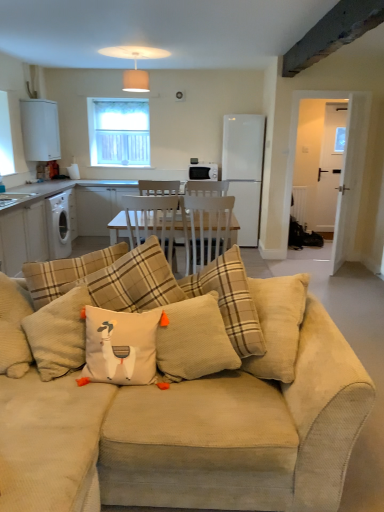
Looking at this image, what is the approximate height of white textured cushion at center, arranged as the second pillow when viewed from the left?

19.72 inches.

What do you see at coordinates (193, 435) in the screenshot?
I see `beige corduroy couch at center` at bounding box center [193, 435].

How much space does black matte toaster at center, which is the second appliance in right-to-left order, occupy vertically?

The height of black matte toaster at center, which is the second appliance in right-to-left order, is 26.77 centimeters.

You are a GUI agent. You are given a task and a screenshot of the screen. Output one action in this format:
    pyautogui.click(x=<x>, y=<y>)
    Task: Click on the black matte toaster at center, arranged as the 1th appliance when viewed from the left
    The height and width of the screenshot is (512, 384).
    Given the screenshot: What is the action you would take?
    pyautogui.click(x=203, y=170)

How much space does white matte refrigerator at center, acting as the first appliance starting from the right, occupy horizontally?

white matte refrigerator at center, acting as the first appliance starting from the right, is 25.98 inches in width.

This screenshot has width=384, height=512. Describe the element at coordinates (333, 33) in the screenshot. I see `dark gray concrete beam at upper right` at that location.

This screenshot has width=384, height=512. Find the location of `dark gray concrete beam at upper right`. dark gray concrete beam at upper right is located at coordinates (333, 33).

What do you see at coordinates (15, 199) in the screenshot? I see `white glossy sink at left` at bounding box center [15, 199].

Measure the distance between white glossy sink at left and camera.

white glossy sink at left and camera are 3.89 meters apart from each other.

Locate an element on the screen. The image size is (384, 512). beige corduroy pillow at center, which appears as the 2th pillow when viewed from the right is located at coordinates (134, 281).

Based on the photo, which of these two, beige corduroy pillow at center, which appears as the 2th pillow when viewed from the right, or beige corduroy couch at center, stands shorter?

beige corduroy pillow at center, which appears as the 2th pillow when viewed from the right.

Is beige corduroy pillow at center, which appears as the 2th pillow when viewed from the right, outside of beige corduroy couch at center?

No, most part of beige corduroy pillow at center, which appears as the 2th pillow when viewed from the right, lies within beige corduroy couch at center.

Is beige corduroy pillow at center, which appears as the 2th pillow when viewed from the right, next to beige corduroy couch at center?

There is a gap between beige corduroy pillow at center, which appears as the 2th pillow when viewed from the right, and beige corduroy couch at center.

Can you tell me how much beige corduroy pillow at center, which appears as the 2th pillow when viewed from the right, and beige corduroy couch at center differ in facing direction?

4.68 degrees.

Which is less distant, (x=328, y=408) or (x=217, y=177)?

Point (x=328, y=408).

Where is `the 2nd appliance behind the beige corduroy couch at center`? the 2nd appliance behind the beige corduroy couch at center is located at coordinates (203, 170).

From the image's perspective, is beige corduroy couch at center beneath black matte toaster at center, arranged as the 1th appliance when viewed from the left?

Yes, from the image's perspective, beige corduroy couch at center is below black matte toaster at center, arranged as the 1th appliance when viewed from the left.

From a real-world perspective, which object rests below the other?

From a 3D spatial view, beige corduroy couch at center is below.

From the image's perspective, which object appears higher, white cotton cushion with orange tassels at center or white textured cushion at center, arranged as the second pillow when viewed from the left?

white textured cushion at center, arranged as the second pillow when viewed from the left, from the image's perspective.

Is white textured cushion at center, the first pillow from the right, at the back of white cotton cushion with orange tassels at center?

No, white cotton cushion with orange tassels at center is not facing away from white textured cushion at center, the first pillow from the right.

In terms of width, does white cotton cushion with orange tassels at center look wider or thinner when compared to white textured cushion at center, arranged as the second pillow when viewed from the left?

white cotton cushion with orange tassels at center is thinner than white textured cushion at center, arranged as the second pillow when viewed from the left.

Does point (103, 349) come in front of point (231, 354)?

Yes.

Which object is wider, dark gray concrete beam at upper right or clear glass window at upper center?

Wider between the two is dark gray concrete beam at upper right.

Can you confirm if dark gray concrete beam at upper right is smaller than clear glass window at upper center?

Correct, dark gray concrete beam at upper right occupies less space than clear glass window at upper center.

Find the location of `window lying above the dark gray concrete beam at upper right (from the image's perspective)`. window lying above the dark gray concrete beam at upper right (from the image's perspective) is located at coordinates (119, 132).

In the image, is clear glass window at upper center positioned in front of or behind white glossy sink at left?

clear glass window at upper center is positioned farther from the viewer than white glossy sink at left.

From the image's perspective, is clear glass window at upper center above or below white glossy sink at left?

From the image's perspective, clear glass window at upper center appears above white glossy sink at left.

Consider the image. Is clear glass window at upper center taller than white glossy sink at left?

Correct, clear glass window at upper center is much taller as white glossy sink at left.

In the scene shown: Is clear glass window at upper center not near white glossy sink at left?

Yes, clear glass window at upper center is far from white glossy sink at left.

Is white textured cushion at center, arranged as the second pillow when viewed from the left, shorter than clear glass window at upper center?

Yes, white textured cushion at center, arranged as the second pillow when viewed from the left, is shorter than clear glass window at upper center.

Which of these two, white textured cushion at center, arranged as the second pillow when viewed from the left, or clear glass window at upper center, is bigger?

clear glass window at upper center.

From the picture: Does white textured cushion at center, arranged as the second pillow when viewed from the left, have a lesser width compared to clear glass window at upper center?

In fact, white textured cushion at center, arranged as the second pillow when viewed from the left, might be wider than clear glass window at upper center.

Can you confirm if white textured cushion at center, the first pillow from the right, is positioned to the right of clear glass window at upper center?

Yes.

Looking at this image, considering the sizes of objects black matte toaster at center, arranged as the 1th appliance when viewed from the left, and white glossy sink at left in the image provided, who is taller, black matte toaster at center, arranged as the 1th appliance when viewed from the left, or white glossy sink at left?

black matte toaster at center, arranged as the 1th appliance when viewed from the left, is taller.

Is the depth of black matte toaster at center, arranged as the 1th appliance when viewed from the left, less than that of white glossy sink at left?

No.

From a real-world perspective, relative to white glossy sink at left, is black matte toaster at center, which is the second appliance in right-to-left order, vertically above or below?

In terms of real-world spatial position, black matte toaster at center, which is the second appliance in right-to-left order, is above white glossy sink at left.

Find the location of a particular element. This screenshot has width=384, height=512. pillow on the left of beige corduroy couch at center is located at coordinates (134, 281).

Find the location of a particular element. studio couch lying below the black matte toaster at center, which is the second appliance in right-to-left order (from the image's perspective) is located at coordinates (193, 435).

Based on their spatial positions, is dark gray concrete beam at upper right or beige corduroy pillow at center, which appears as the 2th pillow when viewed from the right, closer to beige corduroy couch at center?

Based on the image, beige corduroy pillow at center, which appears as the 2th pillow when viewed from the right, appears to be nearer to beige corduroy couch at center.

Considering their positions, is beige corduroy pillow at center, marked as the first pillow in a left-to-right arrangement, positioned further to dark gray concrete beam at upper right than beige corduroy couch at center?

Among the two, beige corduroy couch at center is located further to dark gray concrete beam at upper right.

Considering their positions, is white glossy sink at left positioned further to beige corduroy couch at center than white matte refrigerator at center, the 2th appliance from the left?

Based on the image, white matte refrigerator at center, the 2th appliance from the left, appears to be further to beige corduroy couch at center.

From the image, which object appears to be farther from white textured cushion at center, the first pillow from the right, black matte toaster at center, which is the second appliance in right-to-left order, or beige corduroy couch at center?

black matte toaster at center, which is the second appliance in right-to-left order, lies further to white textured cushion at center, the first pillow from the right, than the other object.

From the image, which object appears to be nearer to white textured cushion at center, arranged as the second pillow when viewed from the left, white matte refrigerator at center, the 2th appliance from the left, or black matte toaster at center, which is the second appliance in right-to-left order?

Among the two, black matte toaster at center, which is the second appliance in right-to-left order, is located nearer to white textured cushion at center, arranged as the second pillow when viewed from the left.

Estimate the real-world distances between objects in this image. Which object is further from white glossy sink at left, white textured cushion at center, arranged as the second pillow when viewed from the left, or dark gray concrete beam at upper right?

dark gray concrete beam at upper right lies further to white glossy sink at left than the other object.

Looking at the image, which one is located closer to white matte refrigerator at center, the 2th appliance from the left, white textured cushion at center, the first pillow from the right, or beige corduroy couch at center?

white textured cushion at center, the first pillow from the right, is closer to white matte refrigerator at center, the 2th appliance from the left.

Looking at this image, from the image, which object appears to be farther from beige corduroy pillow at center, which appears as the 2th pillow when viewed from the right, white cotton cushion with orange tassels at center or white glossy sink at left?

white glossy sink at left is positioned further to the anchor beige corduroy pillow at center, which appears as the 2th pillow when viewed from the right.

At what (x,y) coordinates should I click in order to perform the action: click on exhaust hood between white textured cushion at center, arranged as the second pillow when viewed from the left, and black matte toaster at center, arranged as the 1th appliance when viewed from the left, in the front-back direction. Please return your answer as a coordinate pair (x, y). Looking at the image, I should click on (333, 33).

Locate an element on the screen. This screenshot has height=512, width=384. exhaust hood between white textured cushion at center, arranged as the second pillow when viewed from the left, and clear glass window at upper center, along the z-axis is located at coordinates (333, 33).

Locate an element on the screen. Image resolution: width=384 pixels, height=512 pixels. sink located between beige corduroy pillow at center, marked as the first pillow in a left-to-right arrangement, and white matte refrigerator at center, the 2th appliance from the left, in the depth direction is located at coordinates (15, 199).

The width and height of the screenshot is (384, 512). What are the coordinates of `exhaust hood located between beige corduroy couch at center and clear glass window at upper center in the depth direction` in the screenshot? It's located at (333, 33).